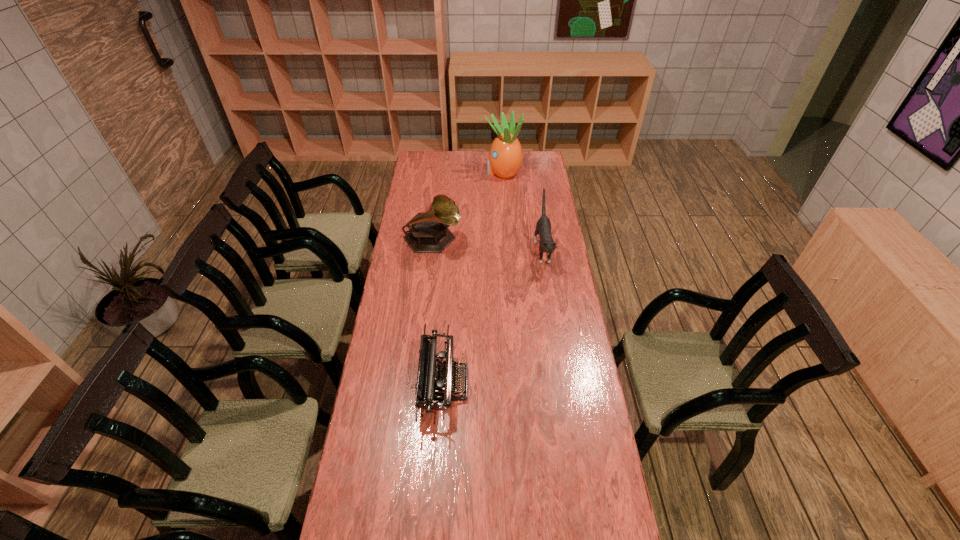
Identify the location of vacant space at the far right corner. (532, 168).

Find the location of a particular element. free space between the pineapple and the shortest object is located at coordinates (473, 278).

The height and width of the screenshot is (540, 960). What are the coordinates of `unoccupied area between the phonograph record and the third object from left to right` in the screenshot? It's located at (468, 206).

Locate an element on the screen. Image resolution: width=960 pixels, height=540 pixels. vacant area between the pineapple and the phonograph record is located at coordinates [468, 206].

Identify the location of vacant point located between the rightmost object and the phonograph record. This screenshot has height=540, width=960. click(x=488, y=245).

This screenshot has width=960, height=540. What are the coordinates of `free area in between the phonograph record and the shortest object` in the screenshot? It's located at (438, 312).

The height and width of the screenshot is (540, 960). Identify the location of free space between the phonograph record and the farthest object. (468, 206).

This screenshot has height=540, width=960. Identify the location of unoccupied position between the rightmost object and the tallest object. (523, 211).

The width and height of the screenshot is (960, 540). I want to click on vacant region between the typewriter and the farthest object, so click(473, 278).

This screenshot has height=540, width=960. In order to click on free space between the phonograph record and the pineapple in this screenshot , I will do click(468, 206).